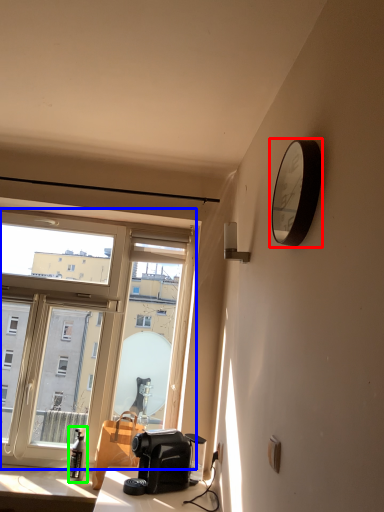
Question: Considering the real-world distances, which object is closest to clock (highlighted by a red box)? window (highlighted by a blue box) or bottle (highlighted by a green box).

Choices:
 (A) window
 (B) bottle

Answer: (A)